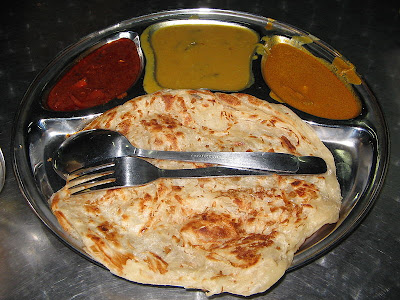
The image size is (400, 300). What are the coordinates of `metal table` in the screenshot? It's located at (335, 272), (105, 289), (390, 110).